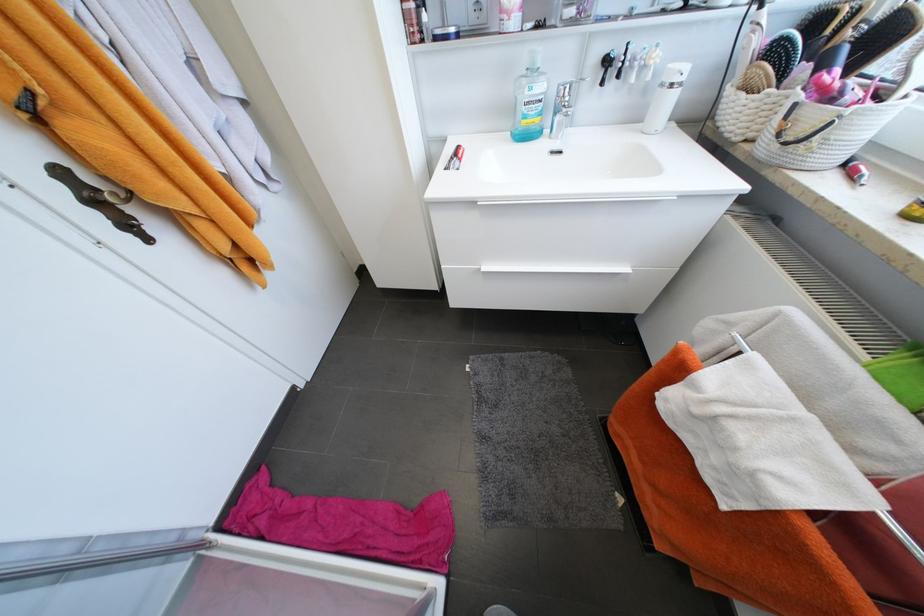
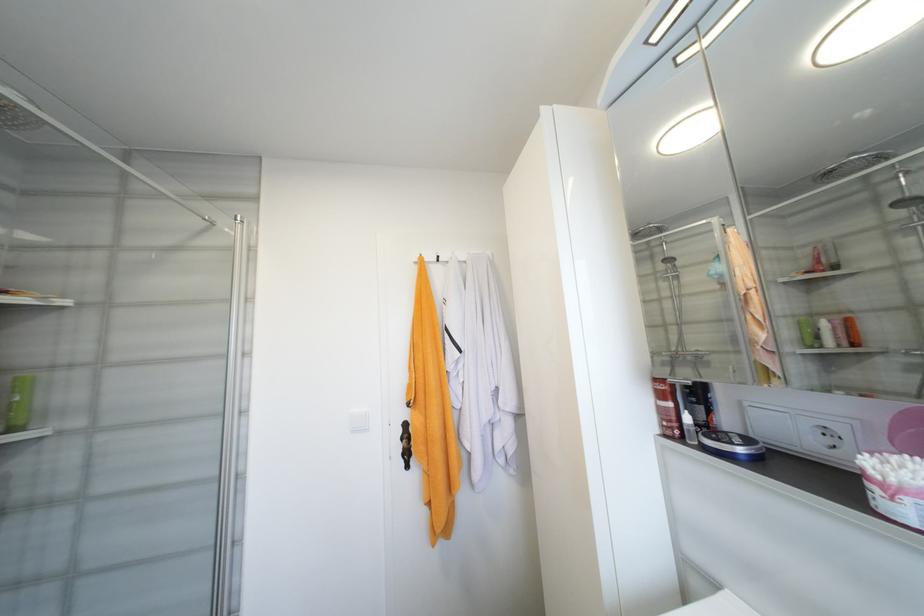
In the second image, find the point that corresponds to the point at 458,31 in the first image.

(747, 451)